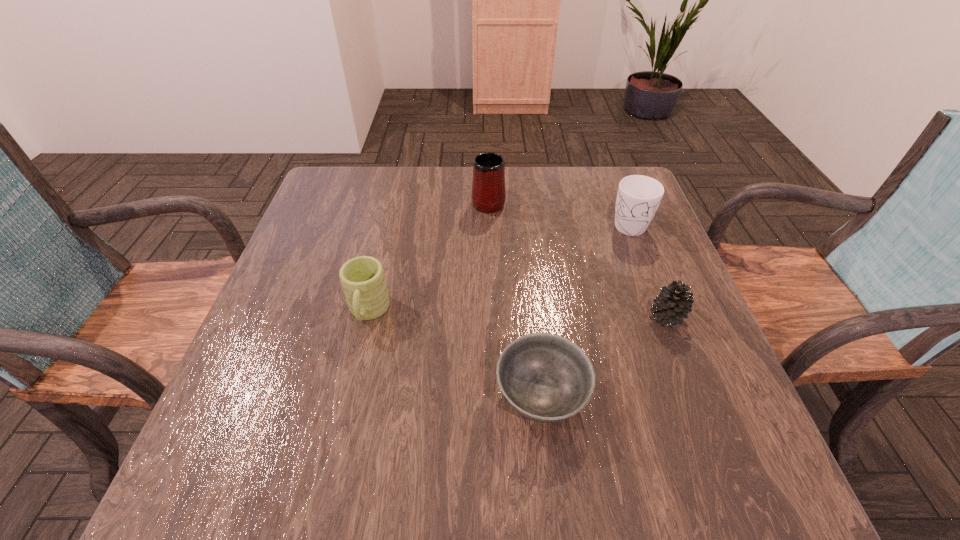
Locate an element on the screen. This screenshot has height=540, width=960. the second mug from right to left is located at coordinates (488, 195).

Where is `the rightmost mug`? The image size is (960, 540). the rightmost mug is located at coordinates (638, 197).

Find the location of `the shortest mug`. the shortest mug is located at coordinates (364, 285).

The height and width of the screenshot is (540, 960). What are the coordinates of `the leftmost mug` in the screenshot? It's located at (364, 285).

Identify the location of pinecone. This screenshot has height=540, width=960. (x=673, y=304).

Where is `bowl`? This screenshot has height=540, width=960. bowl is located at coordinates (546, 378).

Identify the location of the nearest object. (546, 378).

I want to click on vacant space located on the side of the second mug from right to left with the handle, so click(x=488, y=177).

Identify the location of free location located 0.100m on the side of the second mug from right to left with the handle. The width and height of the screenshot is (960, 540). (488, 169).

This screenshot has width=960, height=540. Find the location of `vacant area situated 0.090m on the side of the rightmost mug with the handle`. vacant area situated 0.090m on the side of the rightmost mug with the handle is located at coordinates (644, 265).